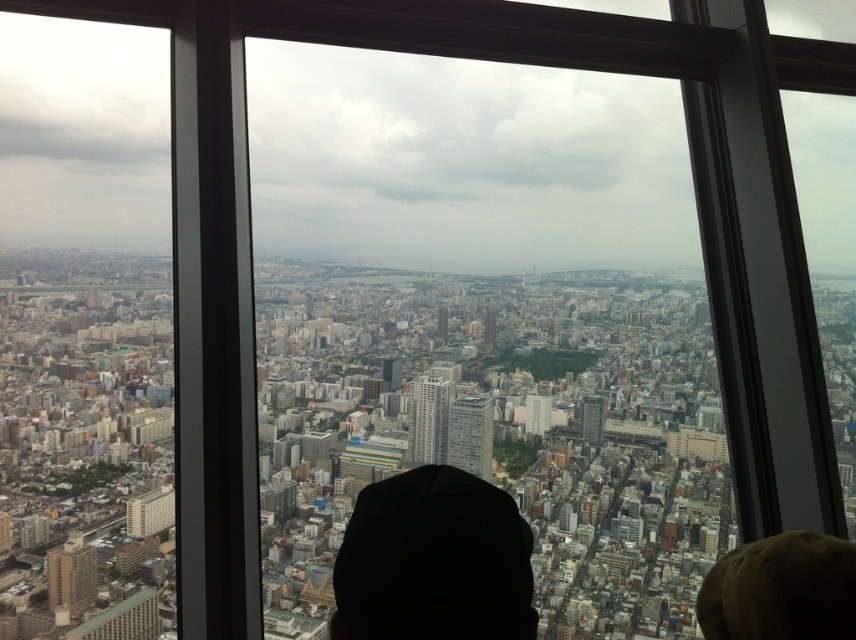
You are an observer looking at the cityscape through the window. You notice two hats in the scene. Which one is taller, the black fabric cap at center or the brown fuzzy hat at lower right?

The black fabric cap at center is taller than the brown fuzzy hat at lower right according to the description.

You are standing at the center of the city and see the point marked as point (432,561). What object is located at that point?

The black fabric cap at center is located at point (432,561).

You are an observer looking at the urban landscape through the window. You notice a black fabric cap at center and a brown fuzzy hat at lower right. Which object is located higher in the image?

The black fabric cap at center is positioned over the brown fuzzy hat at lower right, meaning it is higher up in the image.